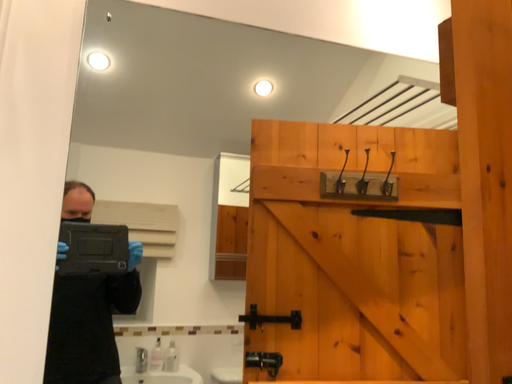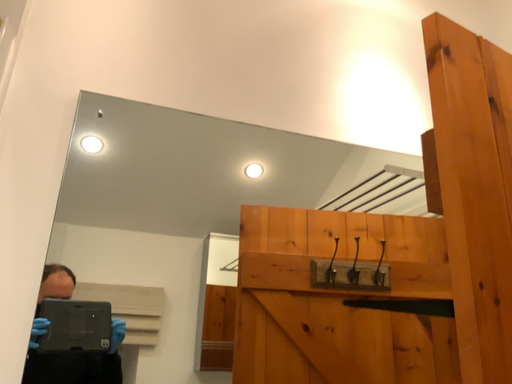
Question: Which way did the camera rotate in the video?

Choices:
 (A) rotated downward
 (B) rotated upward

Answer: (B)